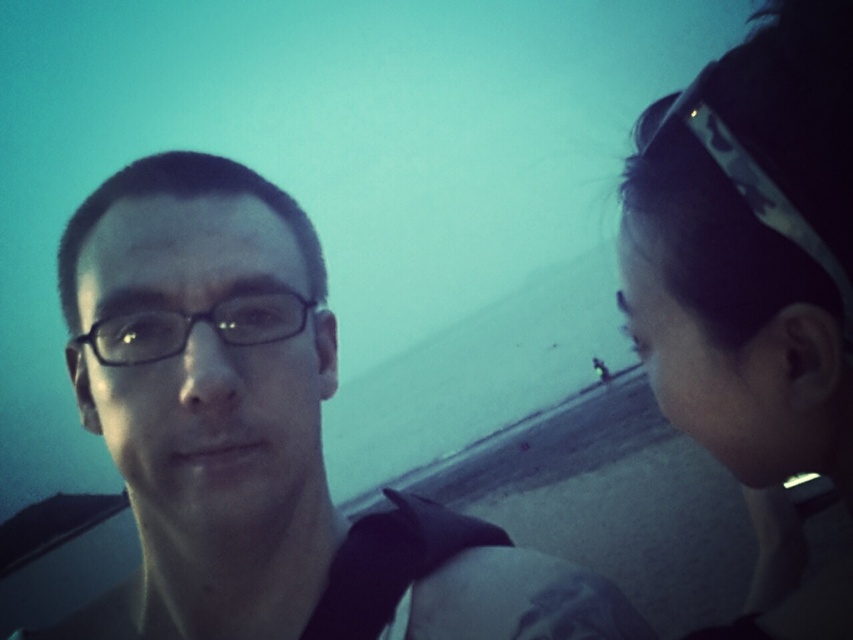
Does point (412, 625) come behind point (834, 349)?

Yes, point (412, 625) is behind point (834, 349).

Does matte black glasses at left have a greater width compared to camouflage headband at upper right?

Indeed, matte black glasses at left has a greater width compared to camouflage headband at upper right.

Between point (415, 604) and point (657, 323), which one is positioned behind?

Point (415, 604)

I want to click on matte black glasses at left, so click(x=260, y=438).

Which is above, matte black glasses at left or black plastic glasses at left?

black plastic glasses at left is higher up.

Which of these two, matte black glasses at left or black plastic glasses at left, stands taller?

matte black glasses at left is taller.

Is point (155, 272) positioned after point (142, 339)?

No, (155, 272) is closer to viewer.

What are the coordinates of `matte black glasses at left` in the screenshot? It's located at (260, 438).

Is camouflage headband at upper right closer to the viewer compared to black plastic glasses at left?

Yes, it is in front of black plastic glasses at left.

Does camouflage headband at upper right have a larger size compared to black plastic glasses at left?

Yes, camouflage headband at upper right is bigger than black plastic glasses at left.

Is point (834, 86) in front of point (280, 317)?

Yes, point (834, 86) is in front of point (280, 317).

Identify the location of camouflage headband at upper right. (756, 289).